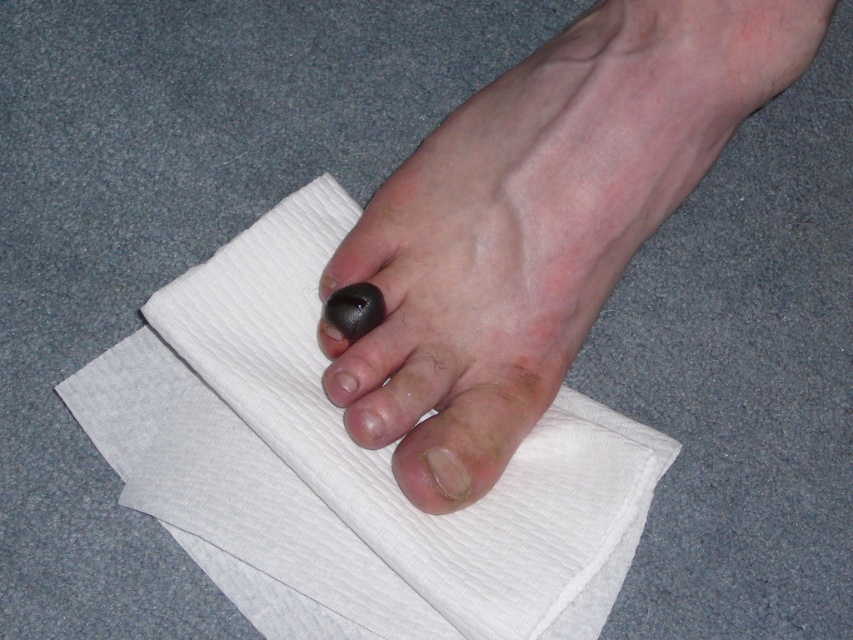
Question: Which of these objects is positioned farthest from the black matte toe at center?

Choices:
 (A) smooth skin toe at center
 (B) white textured cloth at center

Answer: (A)

Question: Which of the following is the closest to the observer?

Choices:
 (A) black matte toe at center
 (B) smooth skin toe at center
 (C) white textured cloth at center

Answer: (C)

Question: Does white textured cloth at center appear over black matte toe at center?

Choices:
 (A) no
 (B) yes

Answer: (A)

Question: Which object is positioned closest to the black matte toe at center?

Choices:
 (A) black rubber toe at center
 (B) smooth skin toe at center
 (C) white textured cloth at center

Answer: (C)

Question: Where is white textured cloth at center located in relation to black rubber toe at center in the image?

Choices:
 (A) left
 (B) right

Answer: (B)

Question: Does white textured cloth at center have a smaller size compared to black matte toe at center?

Choices:
 (A) yes
 (B) no

Answer: (B)